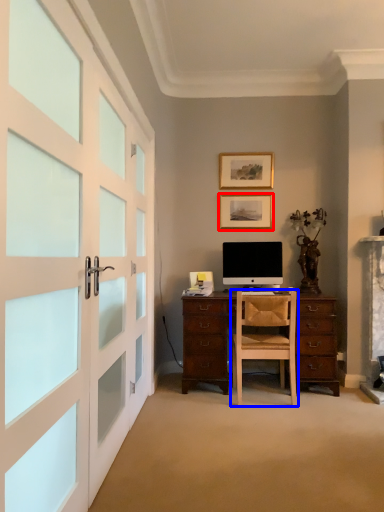
Question: Which object appears farthest to the camera in this image, picture frame (highlighted by a red box) or chair (highlighted by a blue box)?

Choices:
 (A) picture frame
 (B) chair

Answer: (A)